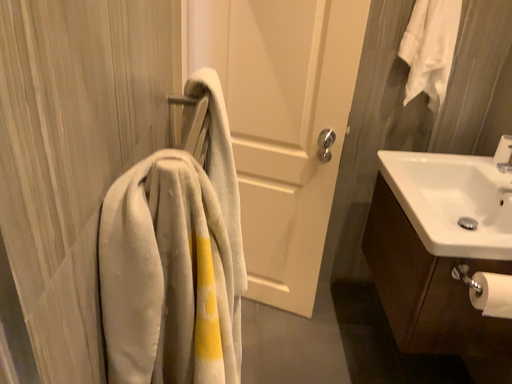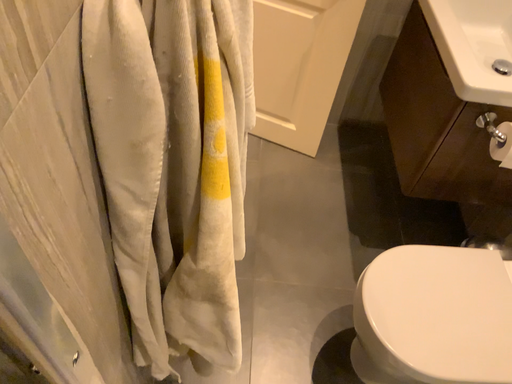
Question: How did the camera likely rotate when shooting the video?

Choices:
 (A) rotated upward
 (B) rotated downward

Answer: (B)